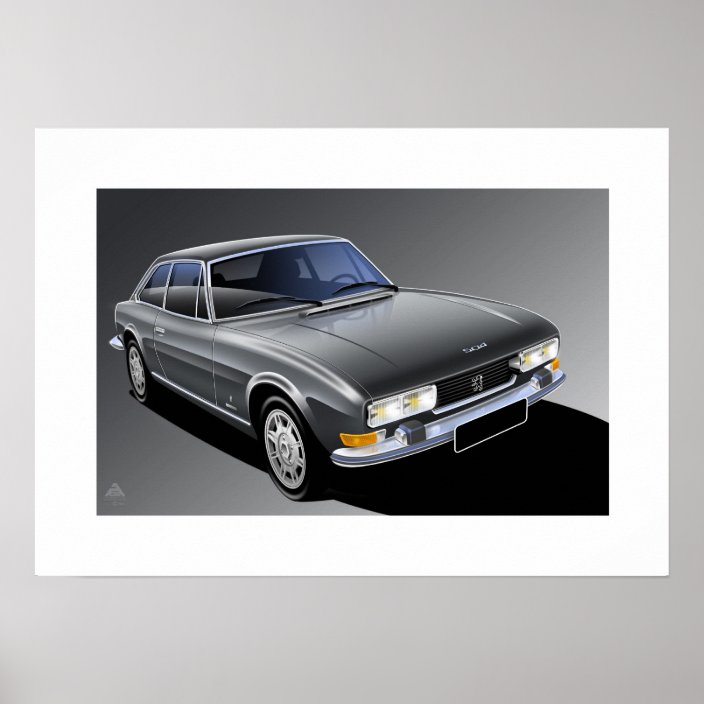
You are a GUI agent. You are given a task and a screenshot of the screen. Output one action in this format:
    pyautogui.click(x=<x>, y=<y>)
    Task: Click on the hood
    The width and height of the screenshot is (704, 704).
    Given the screenshot: What is the action you would take?
    pyautogui.click(x=424, y=344)